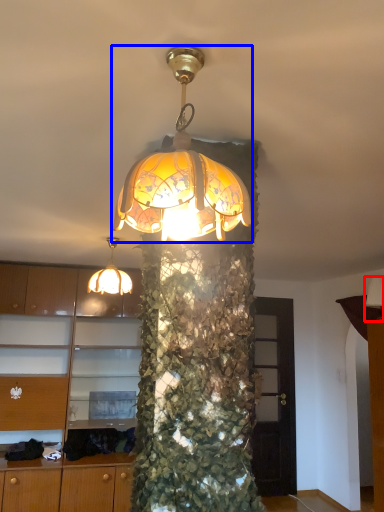
Question: Which point is further to the camera, lamp (highlighted by a red box) or lamp (highlighted by a blue box)?

Choices:
 (A) lamp
 (B) lamp

Answer: (A)